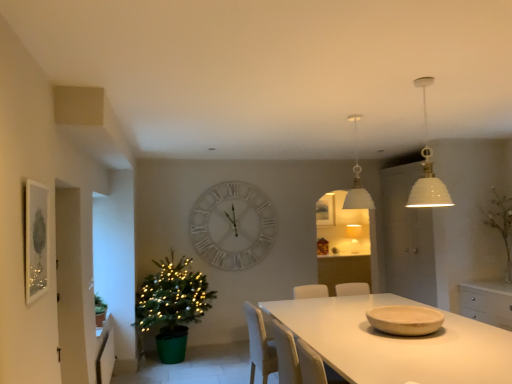
Question: Is white matte table at center positioned behind matte beige bowl at table right?

Choices:
 (A) yes
 (B) no

Answer: (B)

Question: Is white matte table at center bigger than matte beige bowl at table right?

Choices:
 (A) no
 (B) yes

Answer: (B)

Question: Is white matte table at center completely or partially outside of matte beige bowl at table right?

Choices:
 (A) no
 (B) yes

Answer: (B)

Question: Does white matte table at center have a lesser height compared to matte beige bowl at table right?

Choices:
 (A) yes
 (B) no

Answer: (B)

Question: Can you confirm if white matte table at center is thinner than matte beige bowl at table right?

Choices:
 (A) yes
 (B) no

Answer: (B)

Question: Based on their positions, is white ceramic lampshade at upper right, which is the first lamp from front to back, located to the left or right of green matte plant at left, the 2th plant from the top?

Choices:
 (A) left
 (B) right

Answer: (B)

Question: Do you think white ceramic lampshade at upper right, which is the first lamp from front to back, is within green matte plant at left, the second plant in the back-to-front sequence, or outside of it?

Choices:
 (A) inside
 (B) outside

Answer: (B)

Question: Considering the positions of white ceramic lampshade at upper right, the 2th lamp when ordered from back to front, and green matte plant at left, which is the first plant from front to back, in the image, is white ceramic lampshade at upper right, the 2th lamp when ordered from back to front, wider or thinner than green matte plant at left, which is the first plant from front to back,?

Choices:
 (A) thin
 (B) wide

Answer: (B)

Question: Considering their positions, is white ceramic lampshade at upper right, the 2th lamp when ordered from back to front, located in front of or behind green matte plant at left, the second plant in the back-to-front sequence?

Choices:
 (A) behind
 (B) front

Answer: (B)

Question: Do you think white ceramic lampshade at upper right, which is the first lamp from front to back, is within matte silver picture frame at left, which is the 2th picture frame from right to left, or outside of it?

Choices:
 (A) outside
 (B) inside

Answer: (A)

Question: Considering the positions of point (423, 104) and point (32, 253), is point (423, 104) closer or farther from the camera than point (32, 253)?

Choices:
 (A) closer
 (B) farther

Answer: (B)

Question: Considering the positions of white ceramic lampshade at upper right, which is the first lamp from front to back, and matte silver picture frame at left, which is the first picture frame in left-to-right order, in the image, is white ceramic lampshade at upper right, which is the first lamp from front to back, wider or thinner than matte silver picture frame at left, which is the first picture frame in left-to-right order,?

Choices:
 (A) wide
 (B) thin

Answer: (A)

Question: From the image's perspective, is white ceramic lampshade at upper right, which is the first lamp from front to back, located above or below matte silver picture frame at left, which is the 2th picture frame from right to left?

Choices:
 (A) above
 (B) below

Answer: (A)

Question: Based on their sizes in the image, would you say white matte pendant light at upper center, acting as the first lamp starting from the back, is bigger or smaller than white matte table at center?

Choices:
 (A) small
 (B) big

Answer: (A)

Question: From the image's perspective, relative to white matte table at center, is white matte pendant light at upper center, acting as the first lamp starting from the back, above or below?

Choices:
 (A) above
 (B) below

Answer: (A)